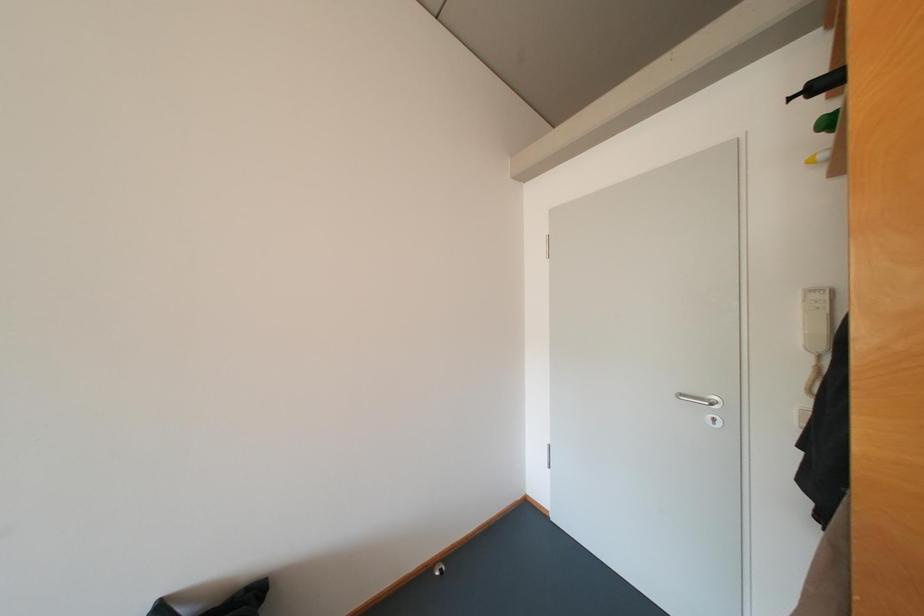
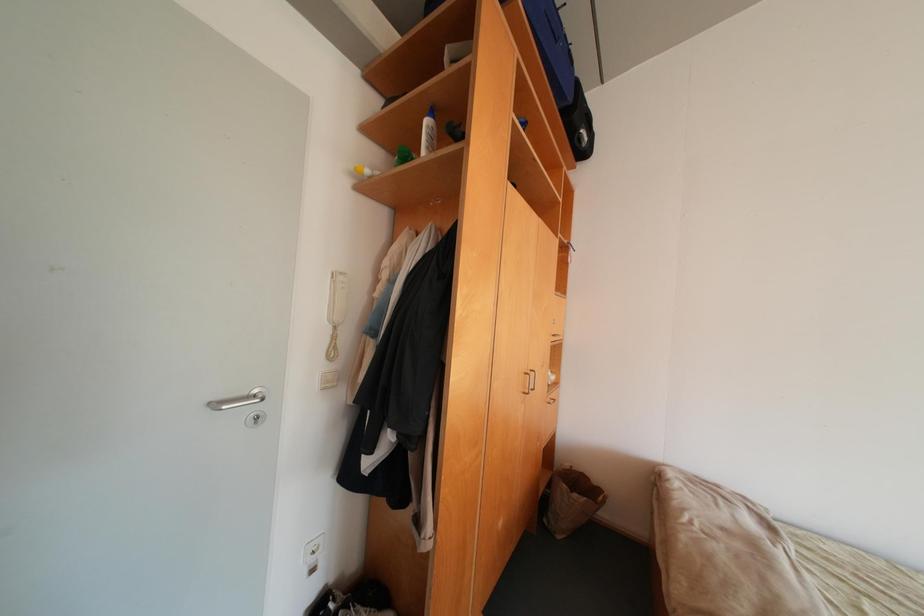
Question: Based on the continuous images, in which direction is the camera rotating? Reply with the corresponding letter.

Choices:
 (A) Left
 (B) Right
 (C) Up
 (D) Down

Answer: (B)